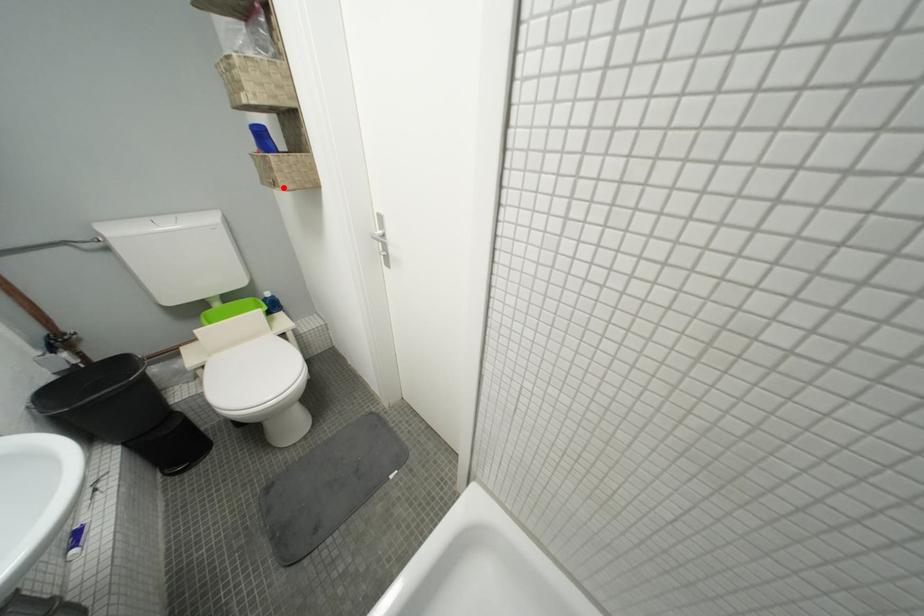
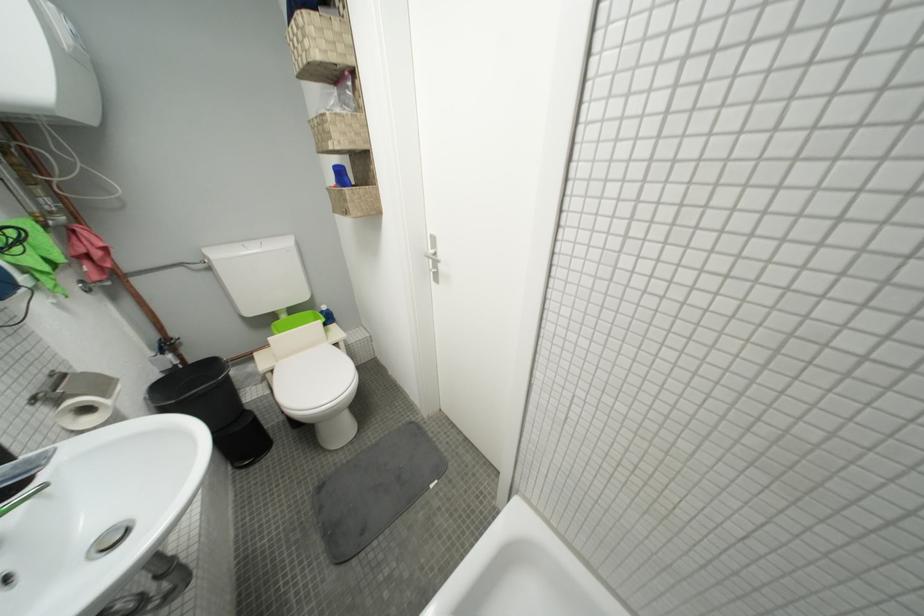
The point at the highlighted location is marked in the first image. Where is the corresponding point in the second image?

(354, 216)